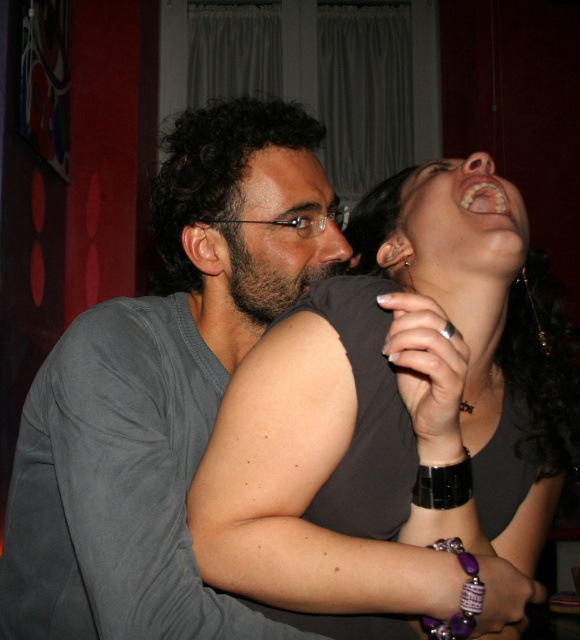
Question: Which point appears closest to the camera in this image?

Choices:
 (A) (194, 374)
 (B) (491, 176)
 (C) (293, 536)

Answer: (C)

Question: Considering the relative positions of gray matte shirt at center and white glossy teeth at upper center in the image provided, where is gray matte shirt at center located with respect to white glossy teeth at upper center?

Choices:
 (A) left
 (B) right

Answer: (A)

Question: Which point is closer to the camera?

Choices:
 (A) (249, 560)
 (B) (495, 177)

Answer: (A)

Question: Is matte gray tank top at center above gray matte shirt at center?

Choices:
 (A) no
 (B) yes

Answer: (A)

Question: Which object is closer to the camera taking this photo?

Choices:
 (A) white glossy teeth at upper center
 (B) gray matte shirt at center

Answer: (B)

Question: Does matte gray tank top at center appear over white glossy teeth at upper center?

Choices:
 (A) no
 (B) yes

Answer: (A)